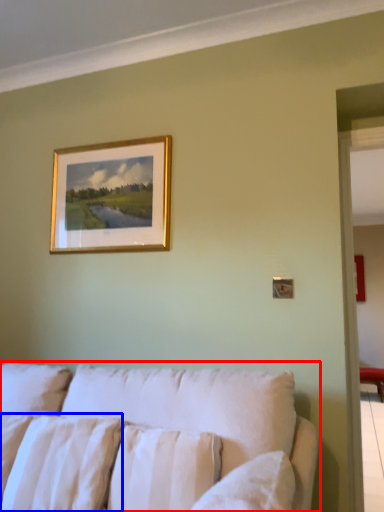
Question: Which object appears farthest to the camera in this image, studio couch (highlighted by a red box) or pillow (highlighted by a blue box)?

Choices:
 (A) studio couch
 (B) pillow

Answer: (B)